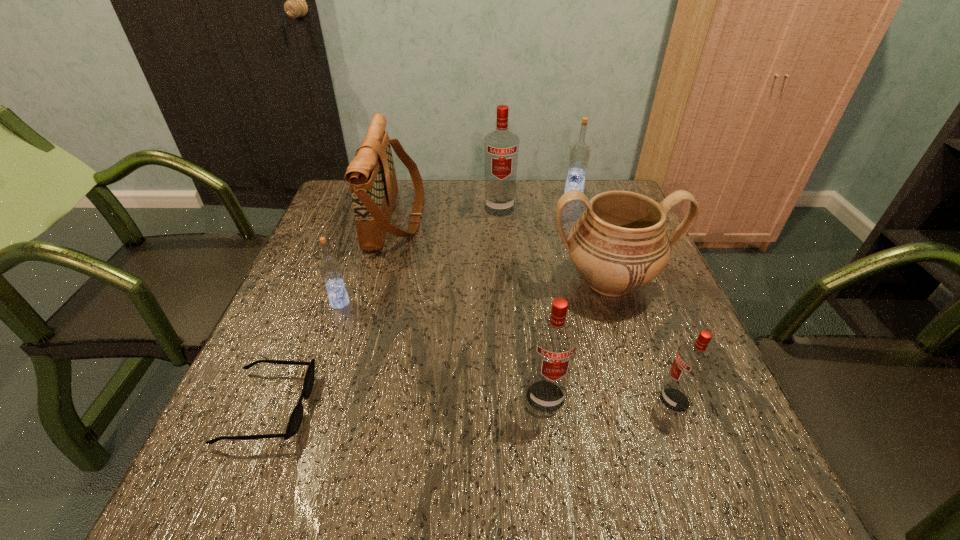
Identify the location of free spot at the far edge of the desktop. (408, 208).

Find the location of a particular element. This screenshot has width=960, height=540. free space at the near edge is located at coordinates (389, 510).

You are a GUI agent. You are given a task and a screenshot of the screen. Output one action in this format:
    pyautogui.click(x=<x>, y=<y>)
    Task: Click on the vacant space at the left edge
    The height and width of the screenshot is (540, 960).
    Given the screenshot: What is the action you would take?
    pyautogui.click(x=316, y=287)

Identify the location of free space at the right edge of the desktop. This screenshot has width=960, height=540. (699, 403).

Where is `vacant space at the near left corner`? This screenshot has width=960, height=540. vacant space at the near left corner is located at coordinates (250, 498).

Find the location of a particular element. Image resolution: width=960 pixels, height=540 pixels. vacant region at the near right corner is located at coordinates (757, 515).

Where is `free spot between the second smallest red vodka and the smaller blue vodka`? free spot between the second smallest red vodka and the smaller blue vodka is located at coordinates pos(443,349).

Image resolution: width=960 pixels, height=540 pixels. In order to click on vacant area between the shoulder bag and the rightmost vodka in this screenshot , I will do `click(536, 309)`.

Find the location of `free space that is in between the shortest object and the bigger blue vodka`. free space that is in between the shortest object and the bigger blue vodka is located at coordinates (420, 301).

You are a GUI agent. You are given a task and a screenshot of the screen. Output one action in this format:
    pyautogui.click(x=<x>, y=<y>)
    Task: Click on the empty space that is in between the shoulder bag and the tallest object
    The width and height of the screenshot is (960, 540).
    Given the screenshot: What is the action you would take?
    pyautogui.click(x=447, y=213)